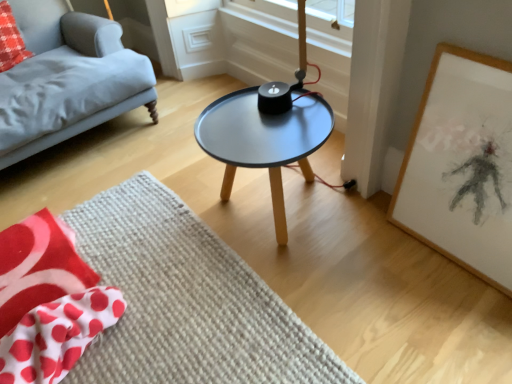
The width and height of the screenshot is (512, 384). What do you see at coordinates (461, 165) in the screenshot? I see `white paper with charcoal drawing at right` at bounding box center [461, 165].

I want to click on red polka dot fabric at upper left, so click(x=10, y=40).

The height and width of the screenshot is (384, 512). What do you see at coordinates (48, 301) in the screenshot? I see `red polka dot fabric at lower left` at bounding box center [48, 301].

Describe the element at coordinates (186, 300) in the screenshot. I see `beige textured mat at center` at that location.

Locate an element on the screen. The height and width of the screenshot is (384, 512). matte gray fabric couch at left is located at coordinates (67, 79).

Considering the sizes of red polka dot fabric at lower left and matte gray fabric couch at left in the image, is red polka dot fabric at lower left wider or thinner than matte gray fabric couch at left?

Clearly, red polka dot fabric at lower left has less width compared to matte gray fabric couch at left.

Would you say red polka dot fabric at lower left is inside or outside matte gray fabric couch at left?

red polka dot fabric at lower left is not inside matte gray fabric couch at left, it's outside.

From the image's perspective, which one is positioned higher, red polka dot fabric at lower left or matte gray fabric couch at left?

matte gray fabric couch at left, from the image's perspective.

Is red polka dot fabric at lower left positioned with its back to matte gray fabric couch at left?

A: Yes, matte gray fabric couch at left is at the back of red polka dot fabric at lower left.

Measure the distance from white paper with charcoal drawing at right to beige textured mat at center.

A distance of 30.50 inches exists between white paper with charcoal drawing at right and beige textured mat at center.

From the image's perspective, which is below, white paper with charcoal drawing at right or beige textured mat at center?

beige textured mat at center appears lower in the image.

From a real-world perspective, is white paper with charcoal drawing at right positioned under beige textured mat at center based on gravity?

No.

Does point (477, 61) come behind point (116, 363)?

No.

Which is correct: beige textured mat at center is inside matte gray fabric couch at left, or outside of it?

beige textured mat at center is not enclosed by matte gray fabric couch at left.

Does beige textured mat at center have a smaller size compared to matte gray fabric couch at left?

Indeed, beige textured mat at center has a smaller size compared to matte gray fabric couch at left.

From the picture: Considering the sizes of beige textured mat at center and matte gray fabric couch at left in the image, is beige textured mat at center wider or thinner than matte gray fabric couch at left?

beige textured mat at center is wider than matte gray fabric couch at left.

From the image's perspective, does red polka dot fabric at lower left appear higher than beige textured mat at center?

Correct, red polka dot fabric at lower left appears higher than beige textured mat at center in the image.

Is red polka dot fabric at lower left smaller than beige textured mat at center?

Indeed, red polka dot fabric at lower left has a smaller size compared to beige textured mat at center.

Is point (18, 321) more distant than point (147, 217)?

No, it is in front of (147, 217).

Considering the relative sizes of red polka dot fabric at lower left and beige textured mat at center in the image provided, is red polka dot fabric at lower left wider than beige textured mat at center?

No, red polka dot fabric at lower left is not wider than beige textured mat at center.

From the image's perspective, is beige textured mat at center beneath red polka dot fabric at lower left?

Yes, from the image's perspective, beige textured mat at center is below red polka dot fabric at lower left.

Is beige textured mat at center in front of or behind red polka dot fabric at lower left in the image?

Clearly, beige textured mat at center is in front of red polka dot fabric at lower left.

Is beige textured mat at center in contact with red polka dot fabric at lower left?

No, beige textured mat at center is not with red polka dot fabric at lower left.

Is beige textured mat at center outside of red polka dot fabric at lower left?

Yes.

Who is bigger, red polka dot fabric at upper left or beige textured mat at center?

beige textured mat at center is bigger.

Considering the sizes of red polka dot fabric at upper left and beige textured mat at center in the image, is red polka dot fabric at upper left wider or thinner than beige textured mat at center?

In the image, red polka dot fabric at upper left appears to be more narrow than beige textured mat at center.

Would you say red polka dot fabric at upper left is to the left or to the right of beige textured mat at center in the picture?

Based on their positions, red polka dot fabric at upper left is located to the left of beige textured mat at center.

From the image's perspective, is red polka dot fabric at upper left above beige textured mat at center?

Yes, from the image's perspective, red polka dot fabric at upper left is over beige textured mat at center.

How different are the orientations of red polka dot fabric at upper left and matte black table at center in degrees?

There is a 88-degree angle between the facing directions of red polka dot fabric at upper left and matte black table at center.

Is red polka dot fabric at upper left closer to camera compared to matte black table at center?

No.

Are red polka dot fabric at upper left and matte black table at center located far from each other?

Yes, red polka dot fabric at upper left and matte black table at center are located far from each other.

From a real-world perspective, is red polka dot fabric at upper left on matte black table at center?

Yes, from a real-world perspective, red polka dot fabric at upper left is over matte black table at center

Where is `studio couch lying above the red polka dot fabric at lower left (from the image's perspective)`? The width and height of the screenshot is (512, 384). studio couch lying above the red polka dot fabric at lower left (from the image's perspective) is located at coordinates (67, 79).

You are a GUI agent. You are given a task and a screenshot of the screen. Output one action in this format:
    pyautogui.click(x=<x>, y=<y>)
    Task: Click on the mat on the left side of white paper with charcoal drawing at right
    This screenshot has width=512, height=384.
    Given the screenshot: What is the action you would take?
    pyautogui.click(x=186, y=300)

Which object lies further to the anchor point matte gray fabric couch at left, beige textured mat at center or white paper with charcoal drawing at right?

white paper with charcoal drawing at right is positioned further to the anchor matte gray fabric couch at left.

When comparing their distances from white paper with charcoal drawing at right, does matte gray fabric couch at left or beige textured mat at center seem closer?

beige textured mat at center.

Estimate the real-world distances between objects in this image. Which object is closer to beige textured mat at center, red polka dot fabric at upper left or matte gray fabric couch at left?

matte gray fabric couch at left is positioned closer to the anchor beige textured mat at center.

When comparing their distances from beige textured mat at center, does red polka dot fabric at upper left or white paper with charcoal drawing at right seem further?

red polka dot fabric at upper left is positioned further to the anchor beige textured mat at center.

Looking at the image, which one is located further to matte gray fabric couch at left, matte black table at center or beige textured mat at center?

beige textured mat at center is further to matte gray fabric couch at left.

From the image, which object appears to be farther from beige textured mat at center, matte black table at center or red polka dot fabric at lower left?

Among the two, matte black table at center is located further to beige textured mat at center.

Looking at the image, which one is located further to red polka dot fabric at lower left, matte gray fabric couch at left or matte black table at center?

matte gray fabric couch at left is further to red polka dot fabric at lower left.

When comparing their distances from beige textured mat at center, does matte black table at center or matte gray fabric couch at left seem further?

matte gray fabric couch at left lies further to beige textured mat at center than the other object.

I want to click on mat located between matte gray fabric couch at left and matte black table at center in the left-right direction, so [186, 300].

This screenshot has height=384, width=512. What are the coordinates of `studio couch between red polka dot fabric at upper left and matte black table at center in the horizontal direction` in the screenshot? It's located at (67, 79).

You are a GUI agent. You are given a task and a screenshot of the screen. Output one action in this format:
    pyautogui.click(x=<x>, y=<y>)
    Task: Click on the coffee table between matte gray fabric couch at left and white paper with charcoal drawing at right in the horizontal direction
    This screenshot has height=384, width=512.
    Given the screenshot: What is the action you would take?
    pyautogui.click(x=263, y=141)

The height and width of the screenshot is (384, 512). I want to click on coffee table between beige textured mat at center and white paper with charcoal drawing at right in the horizontal direction, so click(263, 141).